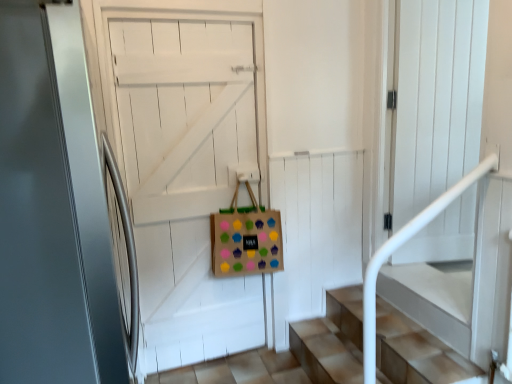
Question: From a real-world perspective, is brown paper bag with colorful cupcake stickers at center physically below wooden door at center, arranged as the 1th door when viewed from the back?

Choices:
 (A) no
 (B) yes

Answer: (A)

Question: Could you tell me if brown paper bag with colorful cupcake stickers at center is turned towards wooden door at center, the second door from the front?

Choices:
 (A) no
 (B) yes

Answer: (A)

Question: Would you consider brown paper bag with colorful cupcake stickers at center to be distant from wooden door at center, arranged as the 1th door when viewed from the back?

Choices:
 (A) no
 (B) yes

Answer: (A)

Question: Does brown paper bag with colorful cupcake stickers at center have a lesser height compared to wooden door at center, the second door from the front?

Choices:
 (A) yes
 (B) no

Answer: (A)

Question: Does brown paper bag with colorful cupcake stickers at center have a larger size compared to wooden door at center, the second door from the front?

Choices:
 (A) no
 (B) yes

Answer: (A)

Question: Does brown paper bag with colorful cupcake stickers at center have a greater height compared to wooden door at center, the second door from the front?

Choices:
 (A) no
 (B) yes

Answer: (A)

Question: Is wooden door at center, the second door from the front, oriented towards brown paper bag with colorful cupcake stickers at center?

Choices:
 (A) yes
 (B) no

Answer: (A)

Question: Does wooden door at center, arranged as the 1th door when viewed from the back, have a larger size compared to brown paper bag with colorful cupcake stickers at center?

Choices:
 (A) no
 (B) yes

Answer: (B)

Question: From a real-world perspective, is wooden door at center, the second door from the front, below brown paper bag with colorful cupcake stickers at center?

Choices:
 (A) yes
 (B) no

Answer: (A)

Question: From a real-world perspective, does wooden door at center, the second door from the front, stand above brown paper bag with colorful cupcake stickers at center?

Choices:
 (A) yes
 (B) no

Answer: (B)

Question: Is wooden door at center, arranged as the 1th door when viewed from the back, further to the viewer compared to brown paper bag with colorful cupcake stickers at center?

Choices:
 (A) no
 (B) yes

Answer: (A)

Question: From the image's perspective, is wooden door at center, arranged as the 1th door when viewed from the back, below brown paper bag with colorful cupcake stickers at center?

Choices:
 (A) yes
 (B) no

Answer: (A)

Question: From the image's perspective, does wooden door at center, arranged as the 1th door when viewed from the back, appear higher than satin white door at center, marked as the 1th door in a front-to-back arrangement?

Choices:
 (A) no
 (B) yes

Answer: (A)